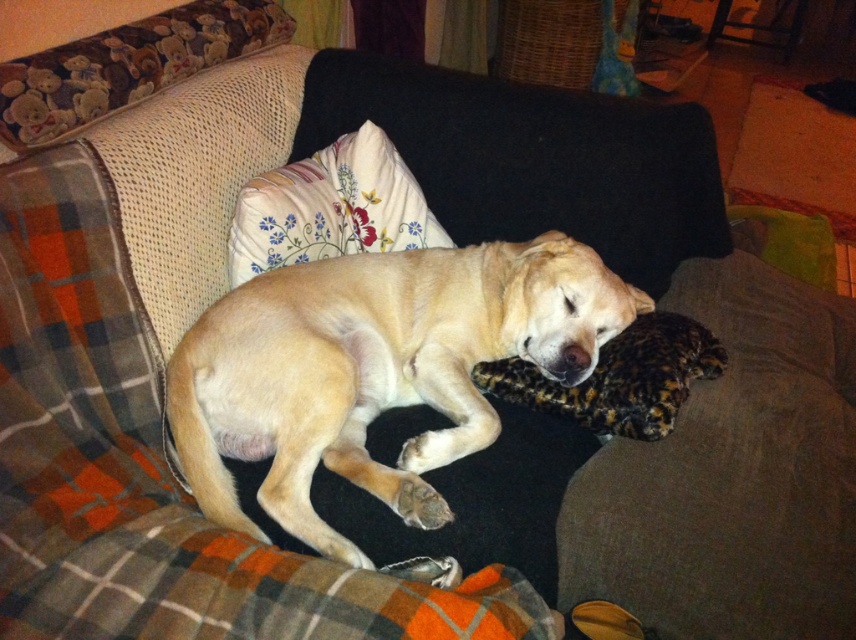
Question: Which point is closer to the camera?

Choices:
 (A) golden fur dog at center
 (B) brown fuzzy pillow at center
 (C) floral fabric pillow at upper center

Answer: (A)

Question: Is the position of floral fabric pillow at upper center more distant than that of brown fuzzy pillow at center?

Choices:
 (A) yes
 (B) no

Answer: (A)

Question: Can you confirm if floral fabric pillow at upper center is thinner than brown fuzzy pillow at center?

Choices:
 (A) no
 (B) yes

Answer: (B)

Question: Which point appears farthest from the camera in this image?

Choices:
 (A) (716, 358)
 (B) (224, 513)

Answer: (A)

Question: Which of the following is the farthest from the observer?

Choices:
 (A) brown fuzzy pillow at center
 (B) golden fur dog at center

Answer: (A)

Question: Is the position of golden fur dog at center more distant than that of brown fuzzy pillow at center?

Choices:
 (A) yes
 (B) no

Answer: (B)